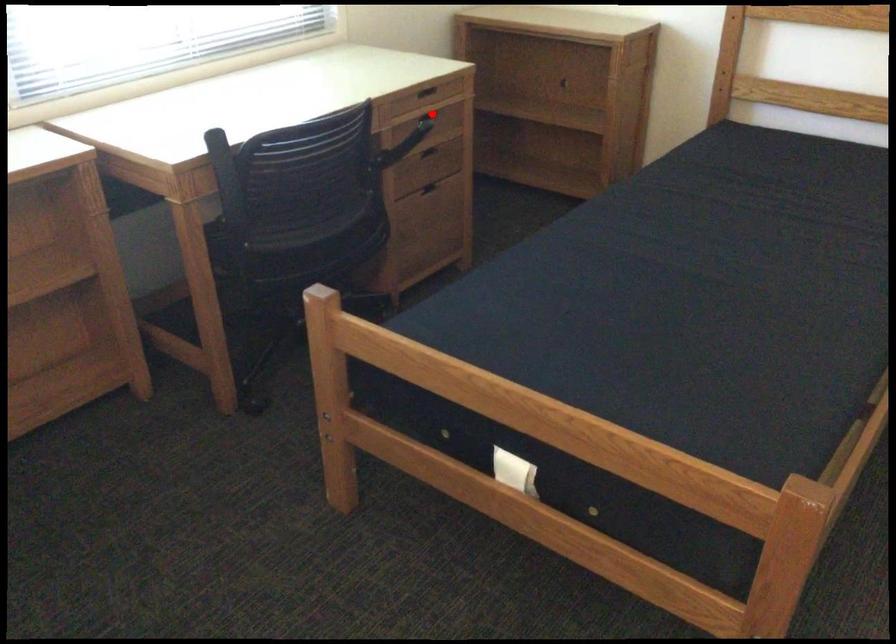
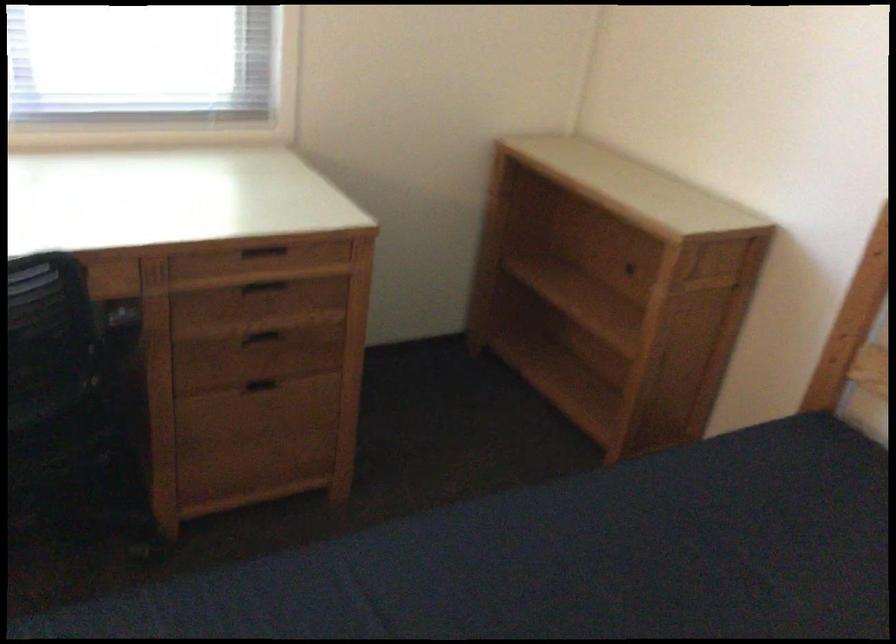
The point at the highlighted location is marked in the first image. Where is the corresponding point in the second image?

(263, 285)